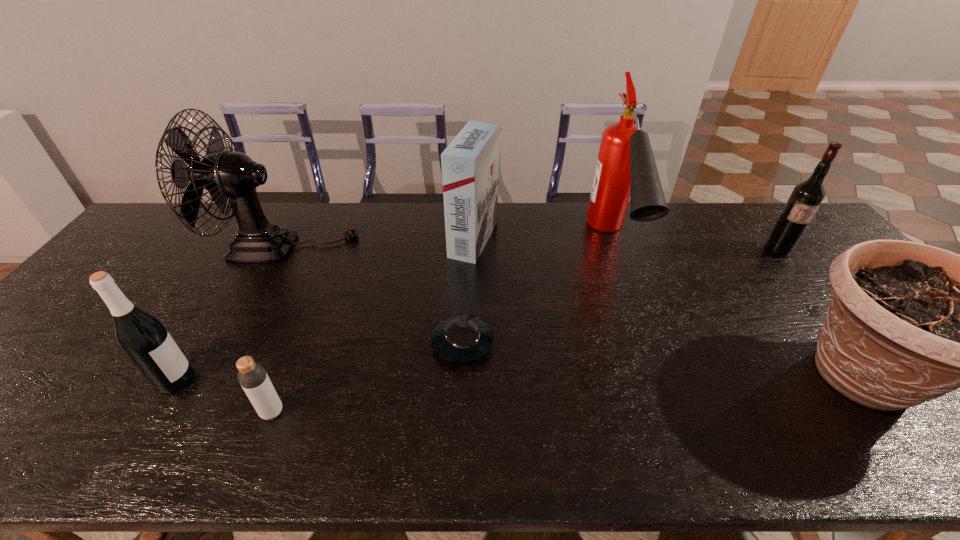
I want to click on vacant space situated 0.360m on the left of the cigarette case, so click(x=337, y=239).

This screenshot has width=960, height=540. I want to click on vacant space positioned 0.320m on the label of the left wine bottle, so click(330, 380).

You are a GUI agent. You are given a task and a screenshot of the screen. Output one action in this format:
    pyautogui.click(x=<x>, y=<y>)
    Task: Click on the vacant space located 0.360m on the back of the bottle
    The height and width of the screenshot is (540, 960).
    Given the screenshot: What is the action you would take?
    (320, 291)

This screenshot has width=960, height=540. Identify the location of vacant region located on the left of the saucer. (273, 343).

Identify the location of fire extinguisher located in the far edge section of the desktop. (626, 171).

The image size is (960, 540). I want to click on fan present at the far edge, so click(x=230, y=177).

You are a GUI agent. You are given a task and a screenshot of the screen. Output one action in this format:
    pyautogui.click(x=<x>, y=<y>)
    Task: Click on the wine bottle that is positioned at the far edge
    The width and height of the screenshot is (960, 540).
    Given the screenshot: What is the action you would take?
    pyautogui.click(x=805, y=199)

Where is `cigarette case located at the far edge`? cigarette case located at the far edge is located at coordinates (470, 164).

The height and width of the screenshot is (540, 960). I want to click on object at the right edge, so click(805, 199).

Locate an element on the screen. object at the far right corner is located at coordinates (805, 199).